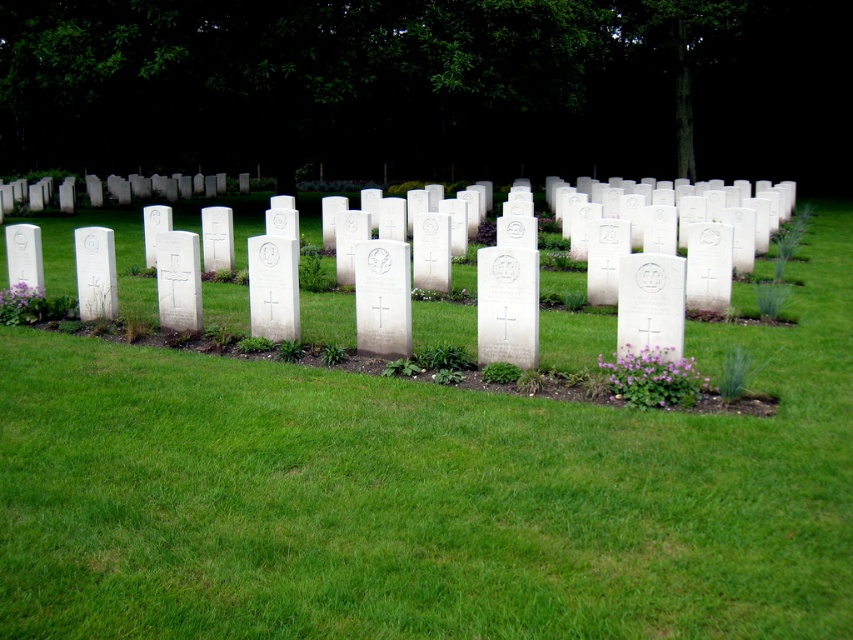
You are designing a new section for the cemetery and want to place a new headstone between the white stone cross at center and the purple matte flower at lower left. Which object should the new headstone be closer to in order to maintain the spacing between the existing headstones?

The new headstone should be closer to the white stone cross at center because it has a lesser width compared to the purple matte flower at lower left, allowing for proper spacing between the existing headstones.

You are standing at the entrance of the cemetery and see the point marked as point (381, 298). What does this point represent?

The point (381, 298) represents the white stone cross at center.

Consider the image. You are planning to place a small garden ornament in the cemetery. The ornament requires a space larger than the purple matte flower at lower left. Can the green grass at center accommodate it?

The green grass at center is larger in size than the purple matte flower at lower left, so it can accommodate the ornament that requires a space larger than the purple matte flower at lower left.